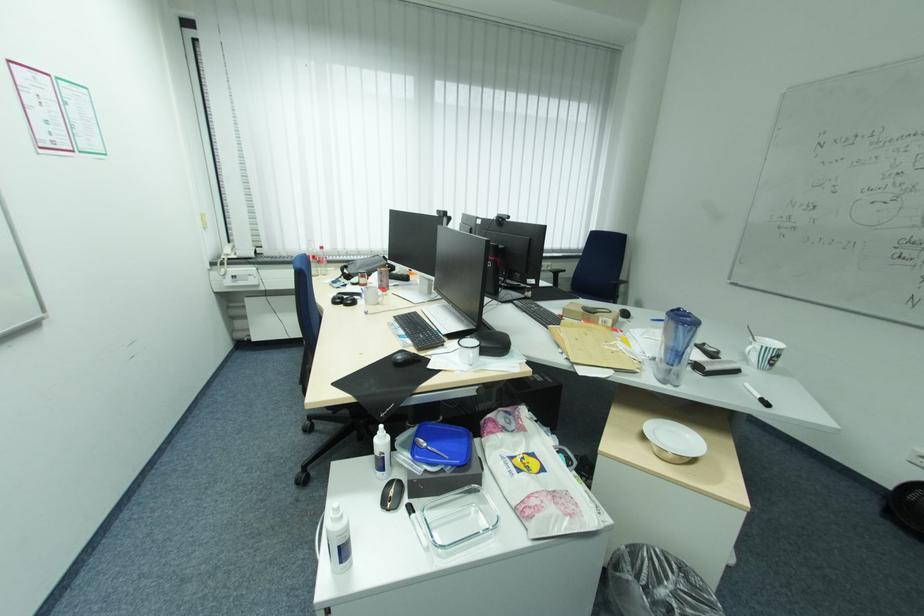
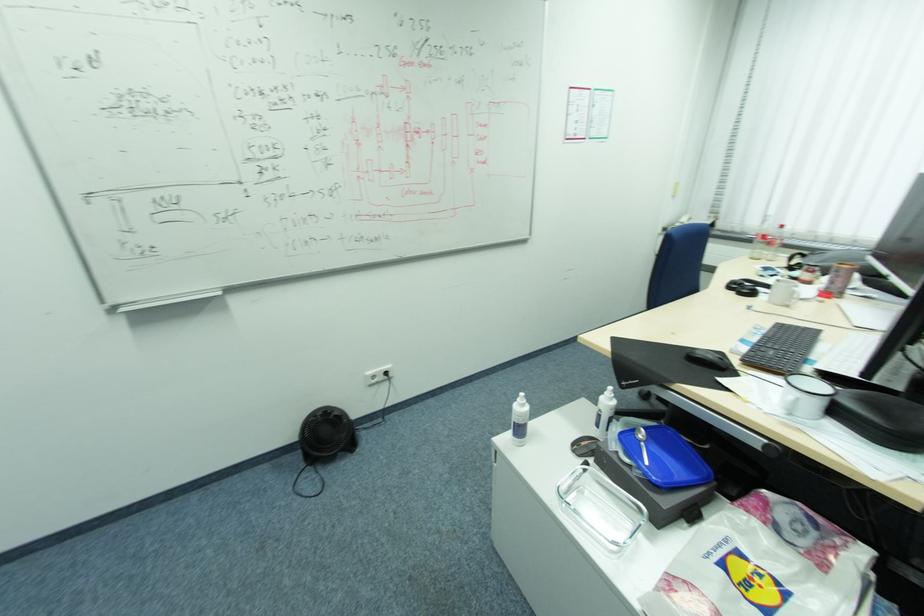
Find the pixel in the second image that matches (x=350, y=549) in the first image.

(526, 430)